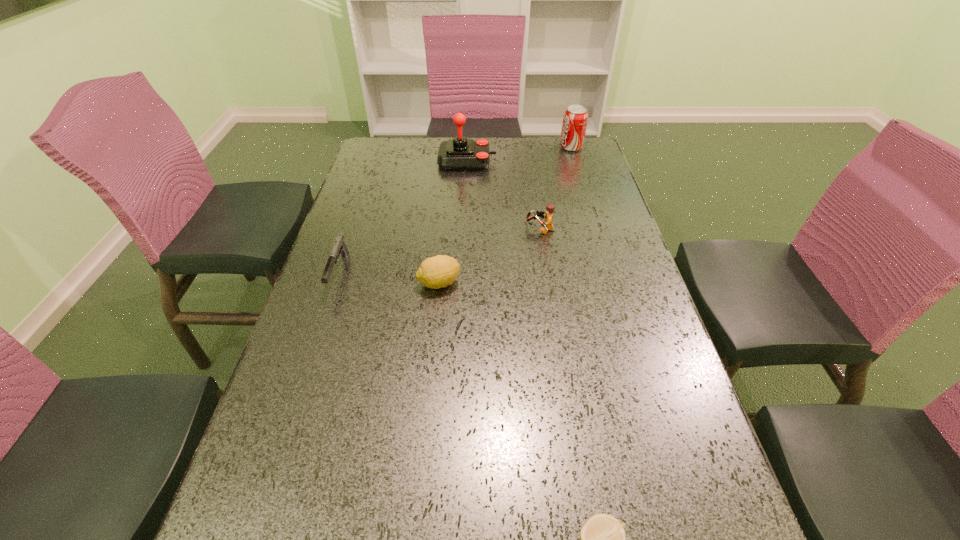
The width and height of the screenshot is (960, 540). Find the location of `the tallest object`. the tallest object is located at coordinates (459, 153).

Locate an element on the screen. soda is located at coordinates (575, 119).

The height and width of the screenshot is (540, 960). What are the coordinates of `the rightmost object` in the screenshot? It's located at (575, 119).

This screenshot has height=540, width=960. Identify the location of the fourth shortest object. (547, 226).

This screenshot has height=540, width=960. In order to click on Lego in this screenshot , I will do `click(547, 226)`.

This screenshot has width=960, height=540. What are the coordinates of `the left lemon` in the screenshot? It's located at (436, 272).

You are a GUI agent. You are given a task and a screenshot of the screen. Output one action in this format:
    pyautogui.click(x=<x>, y=<y>)
    Task: Click on the taller lemon
    The height and width of the screenshot is (540, 960).
    Given the screenshot: What is the action you would take?
    pyautogui.click(x=436, y=272)

At what (x,y) coordinates should I click in order to perform the action: click on gun. Please return your answer as a coordinate pair (x, y). This screenshot has width=960, height=540. Looking at the image, I should click on (339, 247).

Where is `vacant space situated 0.250m on the base of the joystick`? vacant space situated 0.250m on the base of the joystick is located at coordinates (568, 161).

This screenshot has width=960, height=540. Find the location of `free space located 0.050m on the front of the soda`. free space located 0.050m on the front of the soda is located at coordinates (575, 160).